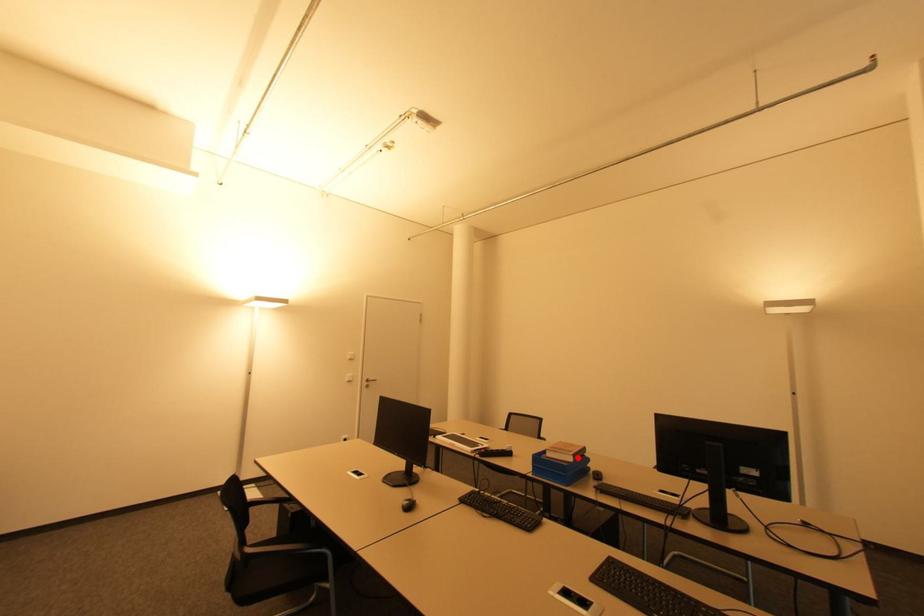
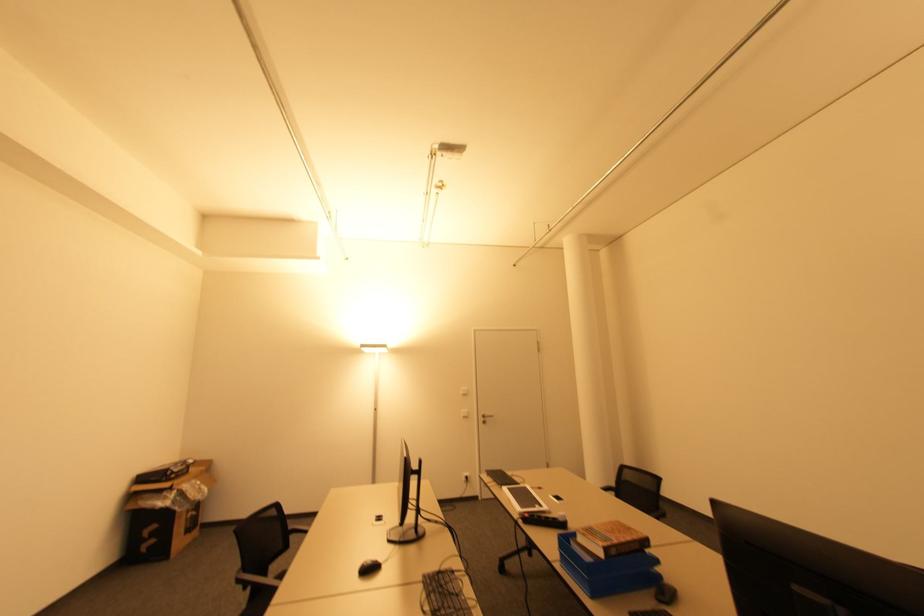
Find the pixel in the second image that matches the highlighted location in the first image.

(615, 553)